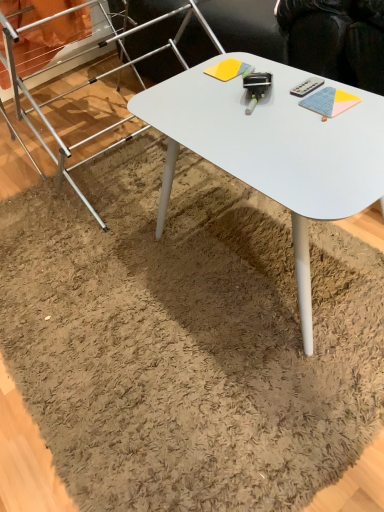
Question: In terms of size, does yellow matte notepad at center, arranged as the 2th notepad when ordered from the bottom, appear bigger or smaller than black plastic remote control at upper right?

Choices:
 (A) small
 (B) big

Answer: (B)

Question: From the image's perspective, is yellow matte notepad at center, marked as the first notepad in a top-to-bottom arrangement, above or below black plastic remote control at upper right?

Choices:
 (A) above
 (B) below

Answer: (A)

Question: Based on their relative distances, which object is nearer to the silver metallic ladder at upper left?

Choices:
 (A) yellow matte notepad at center, marked as the first notepad in a top-to-bottom arrangement
 (B) black plastic remote control at upper right
 (C) white matte desk at center
 (D) textured blue notepad at upper right, acting as the second notepad starting from the back

Answer: (C)

Question: Which object is the farthest from the yellow matte notepad at center, which ranks as the second notepad in front-to-back order?

Choices:
 (A) textured blue notepad at upper right, which is the 1th notepad in front-to-back order
 (B) white matte desk at center
 (C) silver metallic ladder at upper left
 (D) black plastic remote control at upper right

Answer: (C)